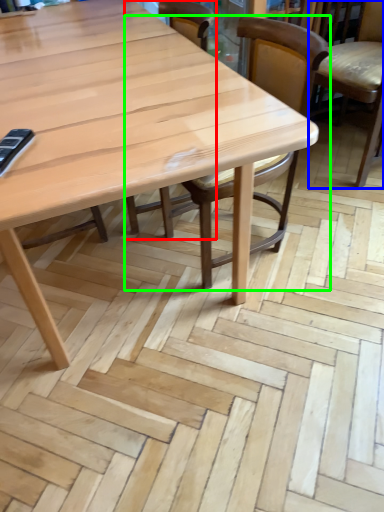
Question: Which object is positioned farthest from chair (highlighted by a red box)? Select from chair (highlighted by a blue box) and chair (highlighted by a green box).

Choices:
 (A) chair
 (B) chair

Answer: (A)